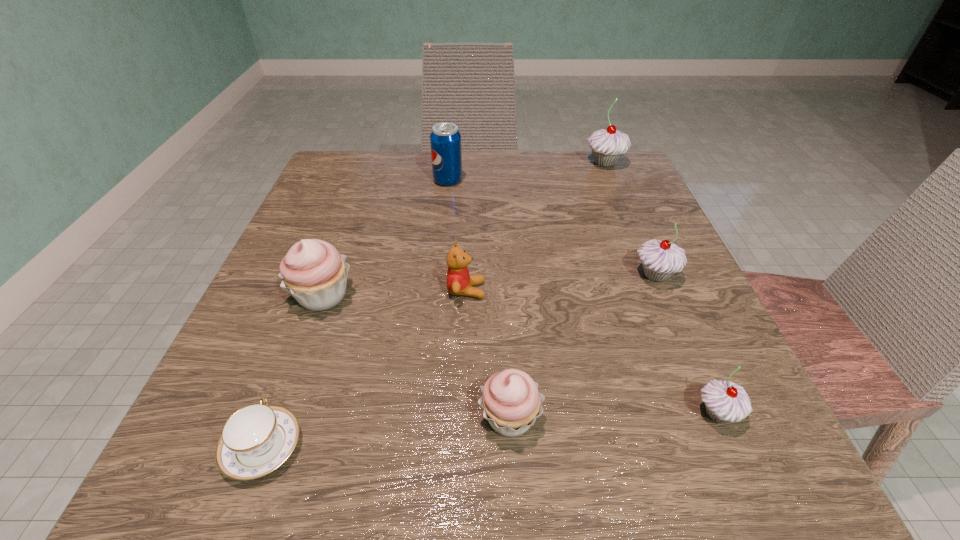
At what (x,y) coordinates should I click in order to perform the action: click on the farthest gray cupcake. Please return your answer as a coordinate pair (x, y). The height and width of the screenshot is (540, 960). Looking at the image, I should click on (607, 146).

At what (x,y) coordinates should I click in order to perform the action: click on the tallest object. Please return your answer as a coordinate pair (x, y). Looking at the image, I should click on (607, 146).

Identify the location of pop soda. (445, 139).

Image resolution: width=960 pixels, height=540 pixels. Find the location of `the left pink cupcake`. the left pink cupcake is located at coordinates (313, 272).

At what (x,y) coordinates should I click in order to perform the action: click on the leftmost cupcake. Please return your answer as a coordinate pair (x, y). This screenshot has width=960, height=540. Looking at the image, I should click on click(x=313, y=272).

Locate an element on the screen. This screenshot has height=540, width=960. the second farthest gray cupcake is located at coordinates tap(660, 259).

Find the location of a particular element. Image resolution: width=960 pixels, height=540 pixels. teddy bear is located at coordinates (459, 282).

Where is `the smallest gray cupcake`? the smallest gray cupcake is located at coordinates (724, 401).

Locate an element on the screen. The image size is (960, 540). the right pink cupcake is located at coordinates (511, 401).

Locate an element on the screen. This screenshot has width=960, height=540. the fourth cupcake from right to left is located at coordinates pyautogui.click(x=511, y=401).